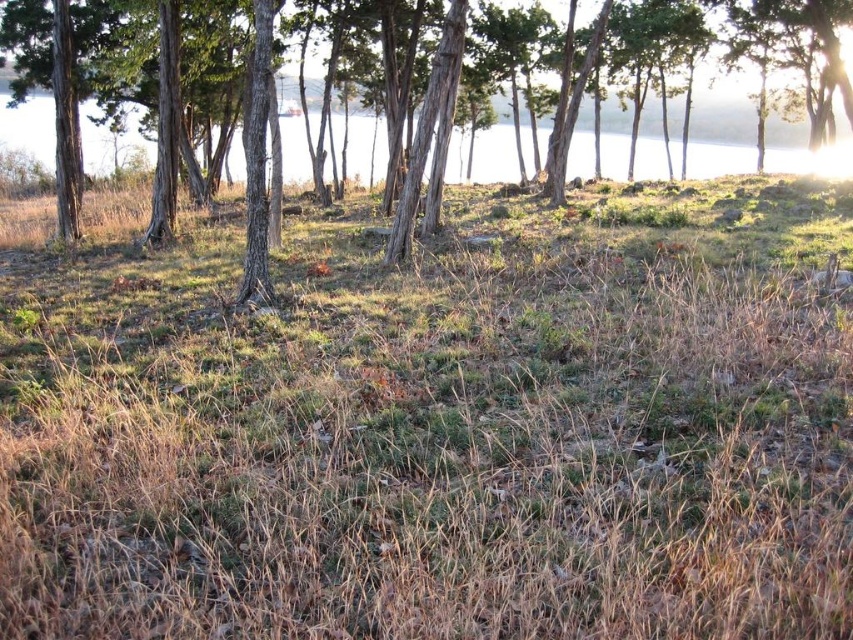
Looking at this image, which of these two, brown dry grass at center or clear water at center, stands taller?

clear water at center

Is point (115, 620) behind point (708, 141)?

No, it is in front of (708, 141).

Between point (593, 337) and point (47, 122), which one is positioned in front?

Point (593, 337) is more forward.

Where is `brown dry grass at center`? This screenshot has width=853, height=640. brown dry grass at center is located at coordinates 440,426.

Is clear water at center to the left of brown rough tree at center from the viewer's perspective?

Yes, clear water at center is to the left of brown rough tree at center.

The image size is (853, 640). I want to click on clear water at center, so click(x=28, y=125).

From the picture: Who is more forward, (107, 132) or (741, 160)?

Point (107, 132)

Image resolution: width=853 pixels, height=640 pixels. I want to click on clear water at center, so click(x=28, y=125).

Where is `brown dry grass at center`? brown dry grass at center is located at coordinates (440, 426).

Is point (505, 301) farther from viewer compared to point (102, 132)?

No, it is not.

Which is in front, point (820, 180) or point (6, 112)?

Point (820, 180)

Find the location of `brown dry grass at center`. brown dry grass at center is located at coordinates (440, 426).